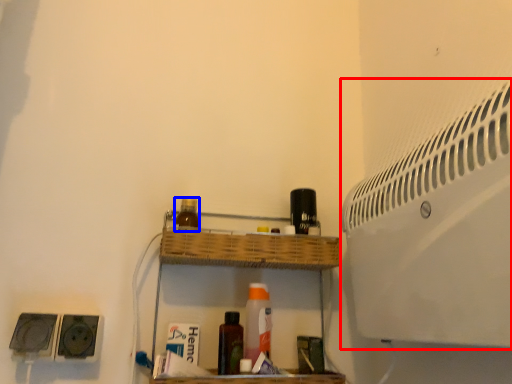
Question: Among these objects, which one is nearest to the camera, air conditioning (highlighted by a red box) or bottle (highlighted by a blue box)?

Choices:
 (A) air conditioning
 (B) bottle

Answer: (A)